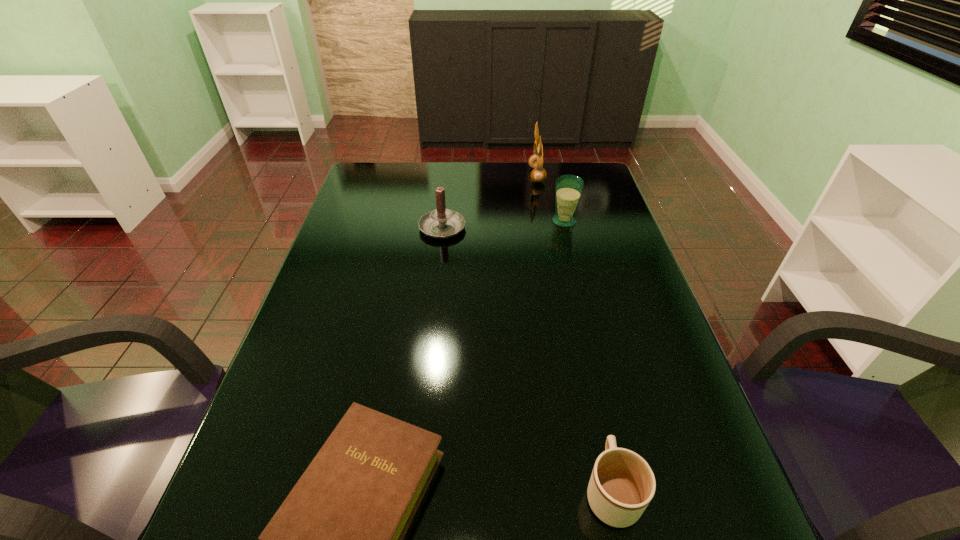
The image size is (960, 540). In order to click on earphone in this screenshot , I will do `click(535, 161)`.

Find the location of a particular element. The width and height of the screenshot is (960, 540). the tallest object is located at coordinates (535, 161).

You are a GUI agent. You are given a task and a screenshot of the screen. Output one action in this format:
    pyautogui.click(x=<x>, y=<y>)
    Task: Click on the candle
    
    Given the screenshot: What is the action you would take?
    pyautogui.click(x=441, y=223)

Find the location of `glass`. glass is located at coordinates (568, 188).

The height and width of the screenshot is (540, 960). Identify the location of mug. (622, 484).

Locate an element on the screen. The width and height of the screenshot is (960, 540). vacant space located 0.140m on the front-facing side of the tallest object is located at coordinates (490, 175).

This screenshot has width=960, height=540. What are the coordinates of `blank space located 0.310m on the front-facing side of the tallest object` in the screenshot? It's located at (443, 175).

Identify the location of vacant space situated 0.250m on the front-facing side of the tallest object. This screenshot has height=540, width=960. pyautogui.click(x=460, y=175).

I want to click on free location located 0.300m on the side of the candle with the handle loop, so click(x=449, y=166).

Where is `vacant space located 0.260m on the side of the candle with the handle loop`? This screenshot has width=960, height=540. vacant space located 0.260m on the side of the candle with the handle loop is located at coordinates (448, 172).